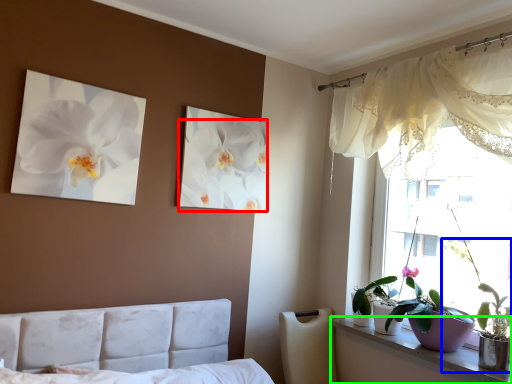
Question: Which object is the closest to the flower (highlighted by a red box)? Choose among these: houseplant (highlighted by a blue box) or window sill (highlighted by a green box).

Choices:
 (A) houseplant
 (B) window sill

Answer: (B)